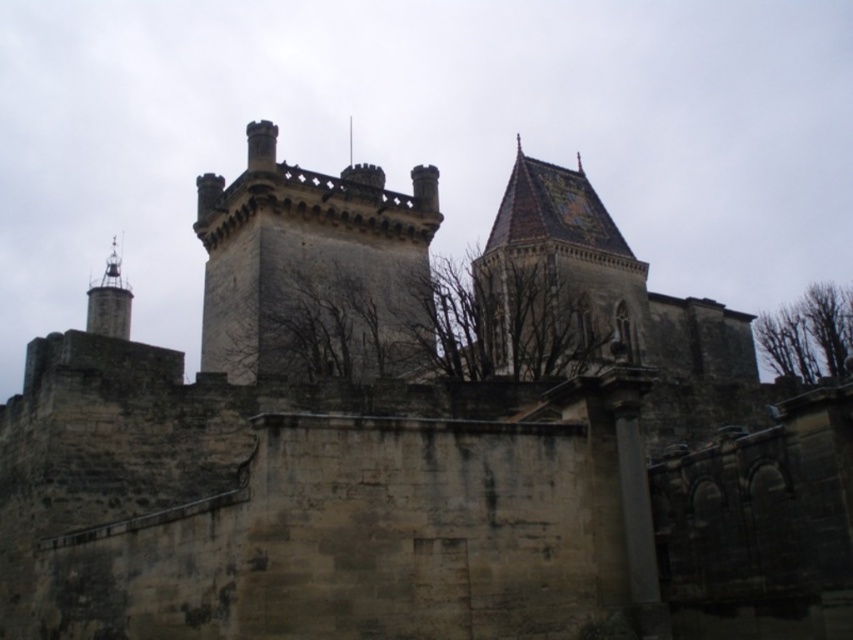
Who is taller, dark gray stone tower at center or bare branches at upper right?

With more height is dark gray stone tower at center.

Which is in front, point (343, 177) or point (793, 326)?

Point (343, 177) is in front.

Locate an element on the screen. The height and width of the screenshot is (640, 853). dark gray stone tower at center is located at coordinates (300, 248).

Can you confirm if bare branches at center is taller than brown tiled roof at upper center?

Incorrect, bare branches at center's height is not larger of brown tiled roof at upper center's.

Is the position of bare branches at center less distant than that of brown tiled roof at upper center?

Yes, it is in front of brown tiled roof at upper center.

Who is more forward, (439, 298) or (637, 301)?

Point (439, 298)

Where is `bare branches at center`? The image size is (853, 640). bare branches at center is located at coordinates (416, 323).

Is bare branches at center to the right of bare branches at upper right from the viewer's perspective?

In fact, bare branches at center is to the left of bare branches at upper right.

Does bare branches at center have a lesser height compared to bare branches at upper right?

Yes, bare branches at center is shorter than bare branches at upper right.

Who is more distant from viewer, (579, 316) or (804, 320)?

Positioned behind is point (804, 320).

The height and width of the screenshot is (640, 853). I want to click on bare branches at center, so click(416, 323).